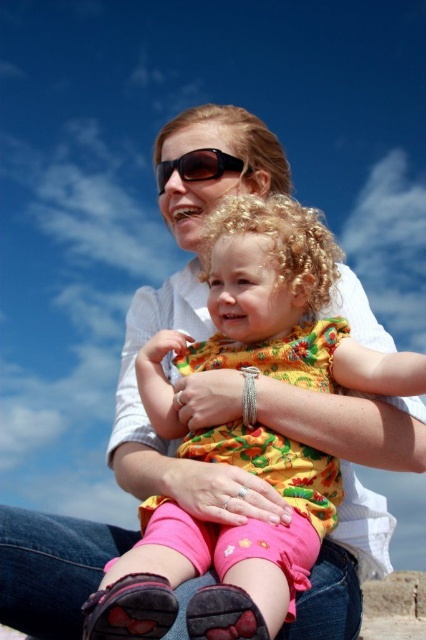
Who is positioned more to the right, floral cotton dress at center or black plastic sunglasses at center?

floral cotton dress at center is more to the right.

Which is below, floral cotton dress at center or black plastic sunglasses at center?

floral cotton dress at center is below.

You are a GUI agent. You are given a task and a screenshot of the screen. Output one action in this format:
    pyautogui.click(x=<x>, y=<y>)
    Task: Click on the floral cotton dress at center
    The height and width of the screenshot is (640, 426).
    Given the screenshot: What is the action you would take?
    pyautogui.click(x=245, y=432)